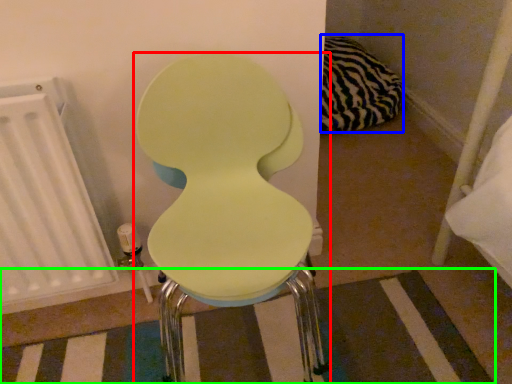
Question: Estimate the real-world distances between objects in this image. Which object is farther from toilet (highlighted by a red box), pillow (highlighted by a blue box) or strip (highlighted by a green box)?

Choices:
 (A) pillow
 (B) strip

Answer: (A)